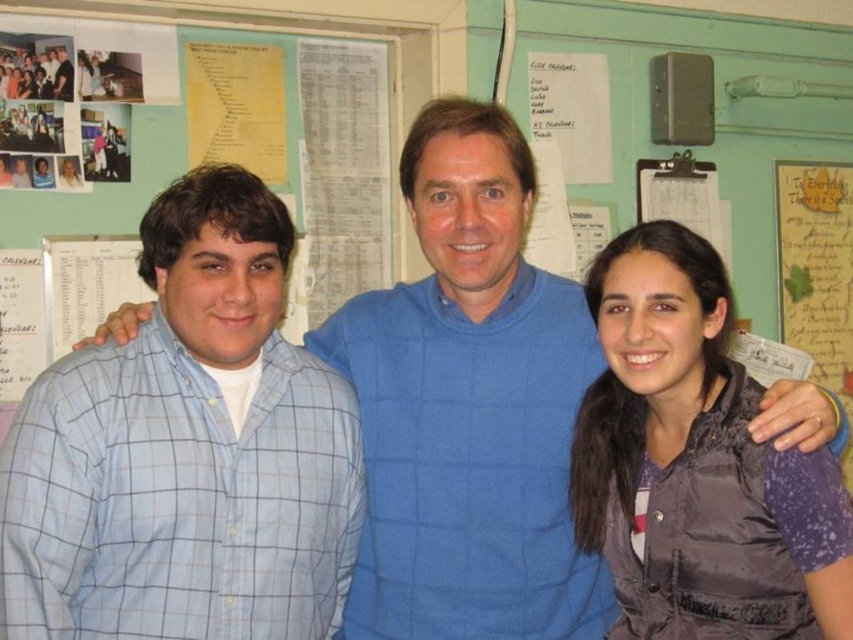
Question: Which is nearer to the matte black shirt at upper left?

Choices:
 (A) blue checkered shirt at left
 (B) dark gray puffy vest at right

Answer: (A)

Question: Where is blue checkered shirt at left located in relation to dark gray puffy vest at right in the image?

Choices:
 (A) left
 (B) right

Answer: (A)

Question: Can you confirm if blue checkered shirt at left is wider than matte black shirt at upper left?

Choices:
 (A) no
 (B) yes

Answer: (B)

Question: Does dark gray puffy vest at right appear under matte black shirt at upper left?

Choices:
 (A) yes
 (B) no

Answer: (A)

Question: Which point is farther from the camera taking this photo?

Choices:
 (A) (68, 64)
 (B) (753, 458)

Answer: (A)

Question: Which of these objects is positioned farthest from the blue checkered shirt at left?

Choices:
 (A) dark gray puffy vest at right
 (B) matte black shirt at upper left

Answer: (B)